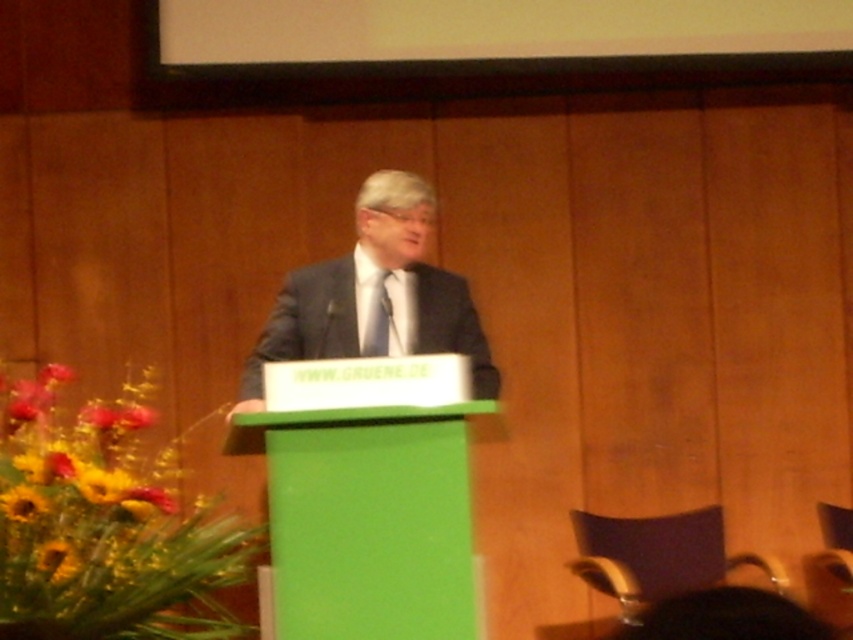
Does blue silk tie at center appear on the left side of yellow sunflower at lower left?

In fact, blue silk tie at center is to the right of yellow sunflower at lower left.

Between blue silk tie at center and yellow sunflower at lower left, which one appears on the left side from the viewer's perspective?

yellow sunflower at lower left is more to the left.

Is point (370, 346) farther from camera compared to point (26, 506)?

Yes, point (370, 346) is behind point (26, 506).

The image size is (853, 640). What are the coordinates of `blue silk tie at center` in the screenshot? It's located at (376, 320).

Is point (403, 188) in front of point (10, 506)?

No, (403, 188) is behind (10, 506).

Between dark gray suit at center and yellow sunflower at lower left, which one is positioned higher?

Positioned higher is dark gray suit at center.

Who is more forward, [277,333] or [36,508]?

Positioned in front is point [36,508].

The width and height of the screenshot is (853, 640). I want to click on dark gray suit at center, so click(x=370, y=292).

Which of these two, dark gray suit at center or blue silk tie at center, stands shorter?

With less height is blue silk tie at center.

Who is higher up, dark gray suit at center or blue silk tie at center?

dark gray suit at center is higher up.

This screenshot has height=640, width=853. In order to click on dark gray suit at center in this screenshot , I will do `click(370, 292)`.